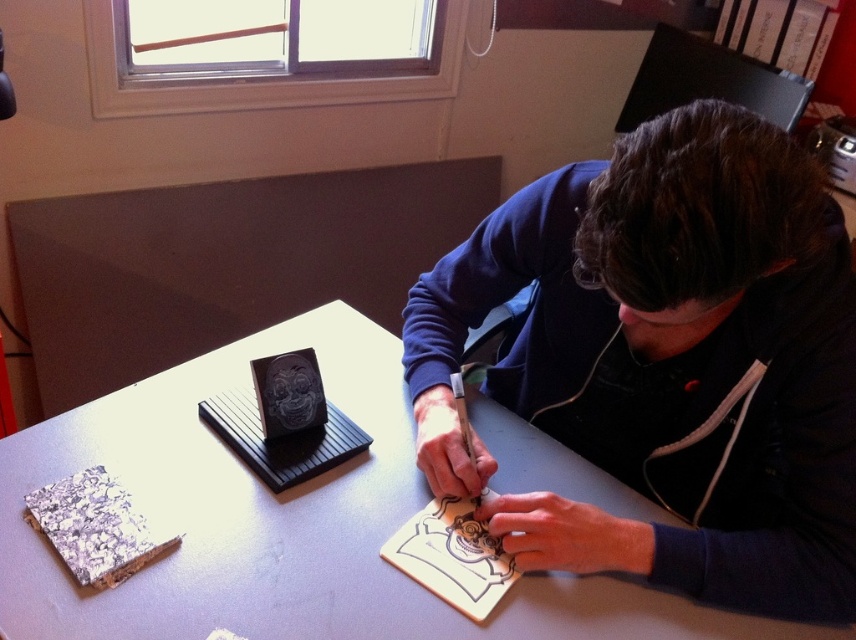
Question: Is the position of dark blue hoodie at center more distant than that of white matte table at center?

Choices:
 (A) no
 (B) yes

Answer: (A)

Question: Does dark blue hoodie at center appear over white matte table at center?

Choices:
 (A) yes
 (B) no

Answer: (A)

Question: Which of the following is the closest to the observer?

Choices:
 (A) dark blue hoodie at center
 (B) white matte table at center

Answer: (A)

Question: Is dark blue hoodie at center to the left of white matte table at center from the viewer's perspective?

Choices:
 (A) no
 (B) yes

Answer: (A)

Question: Which object appears farthest from the camera in this image?

Choices:
 (A) dark blue hoodie at center
 (B) white matte table at center

Answer: (B)